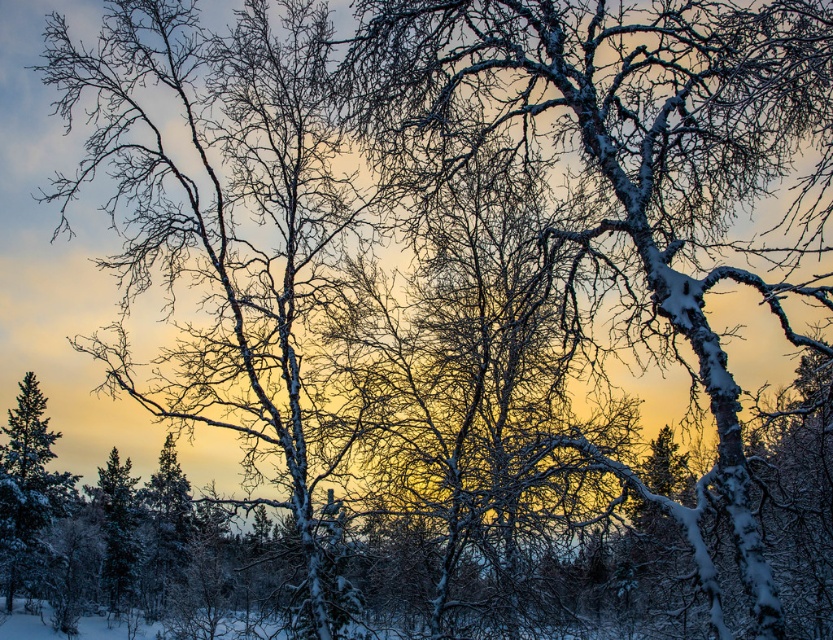
Question: Which object appears farthest from the camera in this image?

Choices:
 (A) snow-covered birch tree at left
 (B) snow-covered branches at center

Answer: (A)

Question: Does snow-covered branches at center have a lesser width compared to snow-covered birch tree at left?

Choices:
 (A) yes
 (B) no

Answer: (A)

Question: Can you confirm if snow-covered branches at center is smaller than snow-covered birch tree at left?

Choices:
 (A) no
 (B) yes

Answer: (B)

Question: Which of the following is the closest to the observer?

Choices:
 (A) snow-covered branches at center
 (B) snow-covered birch tree at left

Answer: (A)

Question: Is snow-covered branches at center to the right of snow-covered birch tree at left from the viewer's perspective?

Choices:
 (A) no
 (B) yes

Answer: (B)